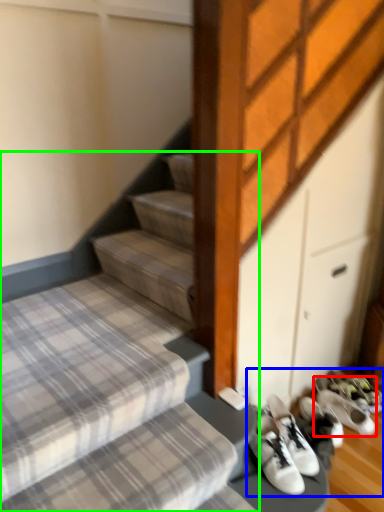
Question: Considering the real-world distances, which object is closest to footwear (highlighted by a red box)? footwear (highlighted by a blue box) or stairs (highlighted by a green box).

Choices:
 (A) footwear
 (B) stairs

Answer: (A)